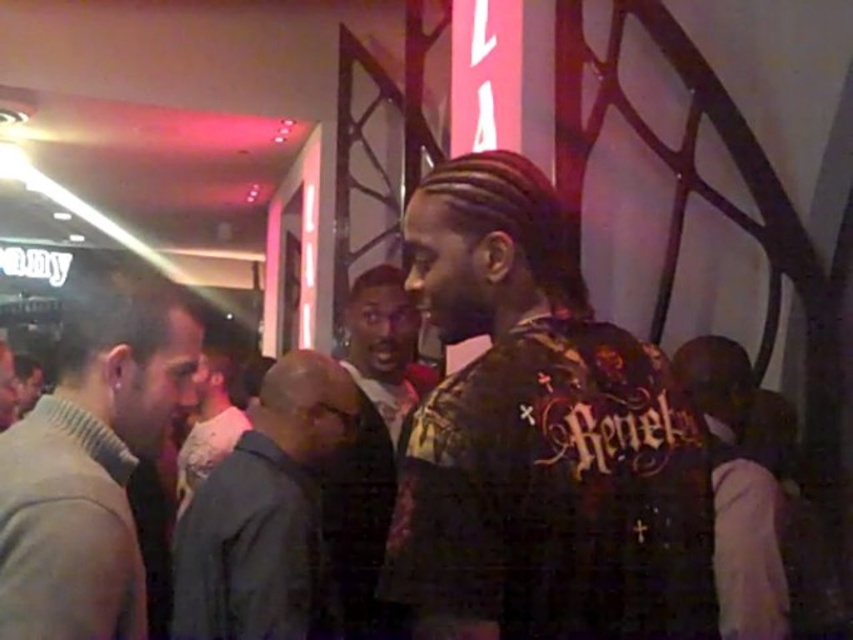
Question: Among these objects, which one is nearest to the camera?

Choices:
 (A) dark brown leather jacket at center
 (B) dark gray jacket at center
 (C) light brown sweater at left

Answer: (C)

Question: Is light brown sweater at left to the right of dark brown leather jacket at center from the viewer's perspective?

Choices:
 (A) no
 (B) yes

Answer: (A)

Question: Is dark gray jacket at center in front of dark brown leather jacket at center?

Choices:
 (A) yes
 (B) no

Answer: (A)

Question: Does printed fabric shirt at center have a greater width compared to dark brown leather jacket at center?

Choices:
 (A) yes
 (B) no

Answer: (A)

Question: Which object appears farthest from the camera in this image?

Choices:
 (A) light brown sweater at left
 (B) dark gray jacket at center
 (C) printed fabric shirt at center

Answer: (B)

Question: Which object appears closest to the camera in this image?

Choices:
 (A) printed fabric shirt at center
 (B) light brown sweater at left
 (C) dark gray jacket at center
 (D) dark brown leather jacket at center

Answer: (A)